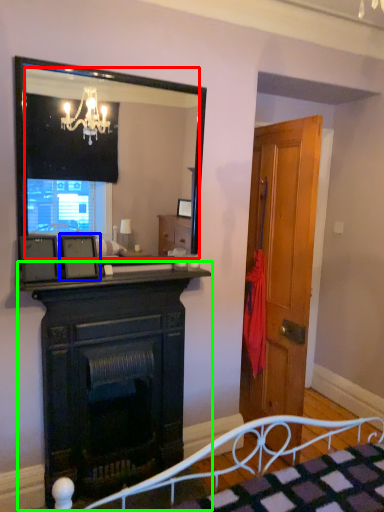
Question: Which is nearer to the mirror (highlighted by a red box)? picture frame (highlighted by a blue box) or fireplace (highlighted by a green box).

Choices:
 (A) picture frame
 (B) fireplace

Answer: (B)